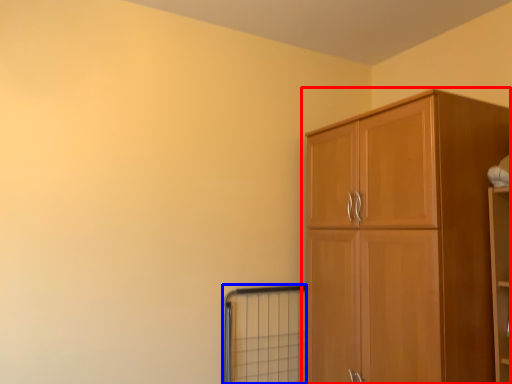
Question: Among these objects, which one is nearest to the camera, cupboard (highlighted by a red box) or window (highlighted by a blue box)?

Choices:
 (A) cupboard
 (B) window

Answer: (A)